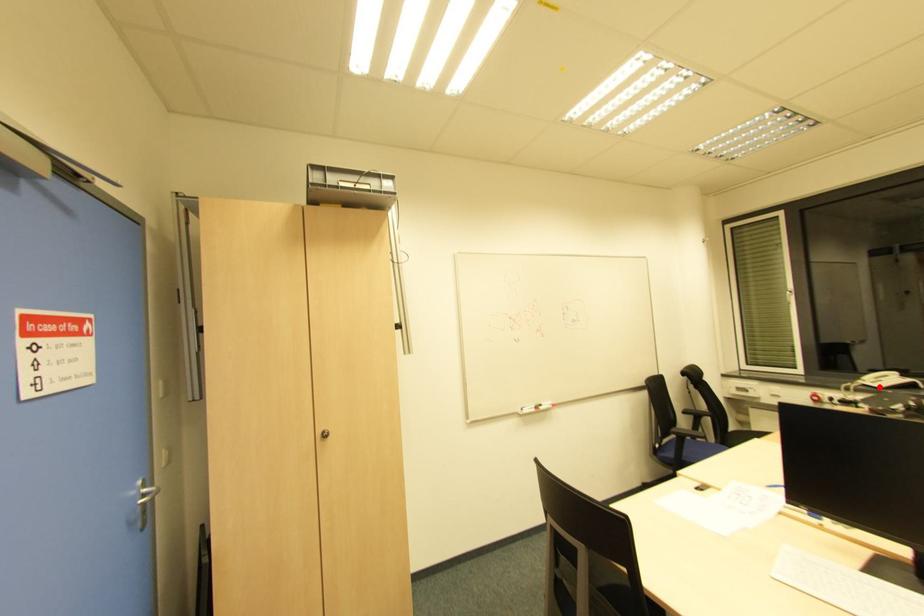
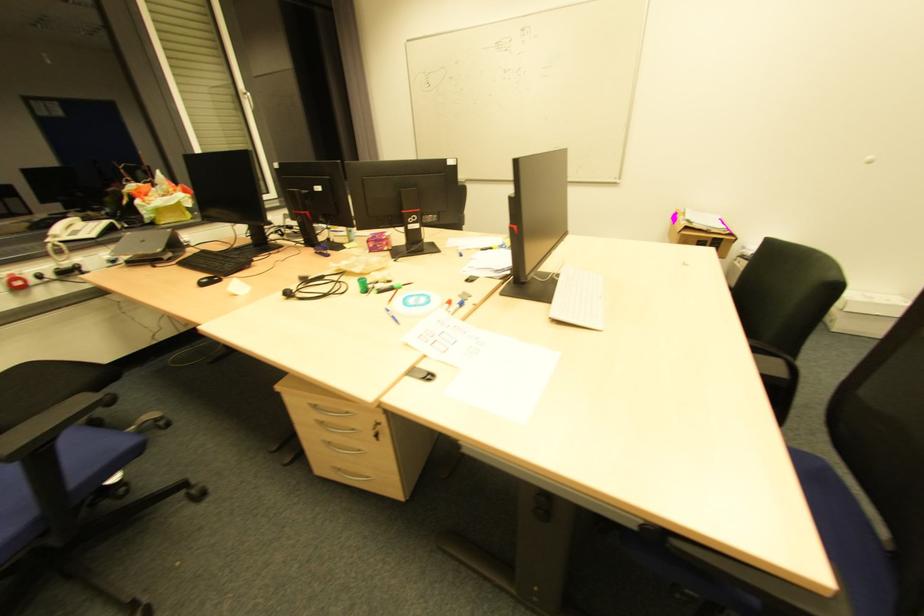
Question: I am providing you with two images of the same scene from different viewpoints. Image1 has a red point marked. In image2, the corresponding 3D location appears at what relative position? Reply with the corresponding letter.

Choices:
 (A) Closer
 (B) Farther

Answer: (A)